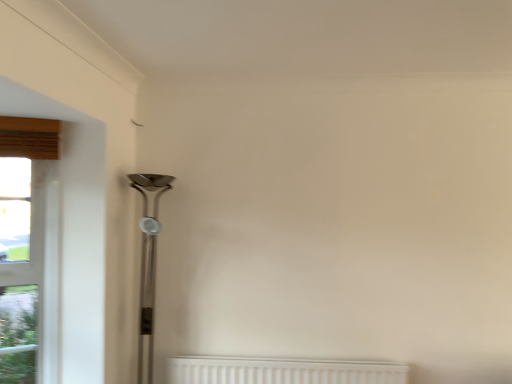
What is the approximate height of clear glass window at left?

clear glass window at left is 1.14 meters in height.

Describe the element at coordinates (29, 250) in the screenshot. I see `clear glass window at left` at that location.

Identify the location of clear glass window at left. The width and height of the screenshot is (512, 384). (29, 250).

At what (x,y) coordinates should I click in order to perform the action: click on polished silver table lamp at left. Please return your answer as a coordinate pair (x, y). Looking at the image, I should click on (148, 265).

What do you see at coordinates (148, 265) in the screenshot? I see `polished silver table lamp at left` at bounding box center [148, 265].

I want to click on clear glass window at left, so click(29, 250).

Which object is positioned more to the right, clear glass window at left or polished silver table lamp at left?

polished silver table lamp at left is more to the right.

Is clear glass window at left closer to camera compared to polished silver table lamp at left?

Yes, it is in front of polished silver table lamp at left.

Is point (25, 188) closer to viewer compared to point (151, 271)?

Yes, point (25, 188) is in front of point (151, 271).

From the image's perspective, is clear glass window at left above polished silver table lamp at left?

No, from the image's perspective, clear glass window at left is not above polished silver table lamp at left.

From a real-world perspective, which object stands above the other?

polished silver table lamp at left.

Which of these two, clear glass window at left or polished silver table lamp at left, is wider?

With larger width is polished silver table lamp at left.

Who is shorter, clear glass window at left or polished silver table lamp at left?

Standing shorter between the two is clear glass window at left.

Which of these two, clear glass window at left or polished silver table lamp at left, is bigger?

Bigger between the two is polished silver table lamp at left.

Would you say polished silver table lamp at left is part of clear glass window at left's contents?

No.

Is clear glass window at left far from polished silver table lamp at left?

No, there isn't a large distance between clear glass window at left and polished silver table lamp at left.

Is clear glass window at left facing away from polished silver table lamp at left?

clear glass window at left is not turned away from polished silver table lamp at left.

Locate an element on the screen. The height and width of the screenshot is (384, 512). table lamp above the clear glass window at left (from the image's perspective) is located at coordinates (148, 265).

Is polished silver table lamp at left to the left of clear glass window at left from the viewer's perspective?

In fact, polished silver table lamp at left is to the right of clear glass window at left.

Which object is closer to the camera, polished silver table lamp at left or clear glass window at left?

clear glass window at left is in front.

Is point (128, 178) closer or farther from the camera than point (31, 208)?

Point (128, 178).

From the image's perspective, would you say polished silver table lamp at left is positioned over clear glass window at left?

Yes.

In the scene shown: From a real-world perspective, is polished silver table lamp at left on clear glass window at left?

Correct, in the physical world, polished silver table lamp at left is higher than clear glass window at left.

Can you confirm if polished silver table lamp at left is wider than clear glass window at left?

Yes, polished silver table lamp at left is wider than clear glass window at left.

Considering the sizes of objects polished silver table lamp at left and clear glass window at left in the image provided, who is taller, polished silver table lamp at left or clear glass window at left?

With more height is polished silver table lamp at left.

Between polished silver table lamp at left and clear glass window at left, which one has smaller size?

clear glass window at left is smaller.

Would you say polished silver table lamp at left is outside clear glass window at left?

Yes, polished silver table lamp at left is outside of clear glass window at left.

Consider the image. Are polished silver table lamp at left and clear glass window at left making contact?

polished silver table lamp at left is not next to clear glass window at left, and they're not touching.

Is polished silver table lamp at left facing away from clear glass window at left?

polished silver table lamp at left does not have its back to clear glass window at left.

Consider the image. How distant is polished silver table lamp at left from clear glass window at left?

The distance of polished silver table lamp at left from clear glass window at left is 22.13 inches.

Locate an element on the screen. Image resolution: width=512 pixels, height=384 pixels. window in front of the polished silver table lamp at left is located at coordinates (29, 250).

At what (x,y) coordinates should I click in order to perform the action: click on table lamp above the clear glass window at left (from a real-world perspective). Please return your answer as a coordinate pair (x, y). The image size is (512, 384). Looking at the image, I should click on (148, 265).

I want to click on table lamp that is behind the clear glass window at left, so click(148, 265).